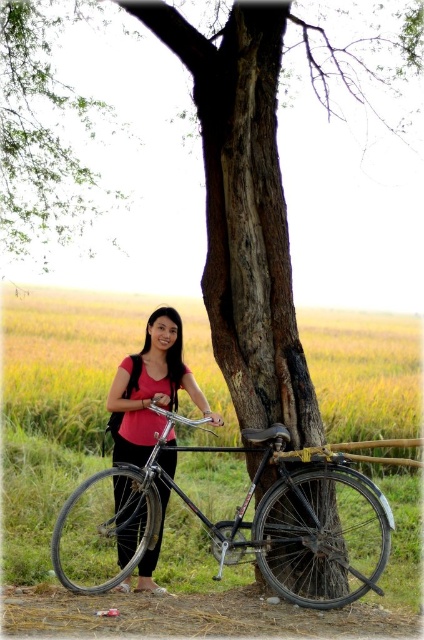
You are standing in the scene and want to place a small flag at the point that is closer to you. Which point should you choose between point (304, 605) and point (123, 529)?

Point (304, 605) is closer to the viewer than point (123, 529), so you should choose point (304, 605) to place the flag.

You are a photographer setting up a shot of the scene. You want to ensure that both the green leafy tree at upper left and the matte pink shirt at center are in focus. Based on their sizes, which object should you prioritize focusing on to ensure it remains sharp?

The green leafy tree at upper left might be wider than the matte pink shirt at center, so you should prioritize focusing on the larger object first to ensure it stays sharp.

You are a photographer trying to capture a photo of the shiny metallic bicycle at center and the matte pink shirt at center. Which object should you focus on first if you want to ensure both are in focus, given that your camera can only focus on one plane at a time?

The shiny metallic bicycle at center is below matte pink shirt at center, so you should focus on the shiny metallic bicycle at center first to ensure both are in focus.